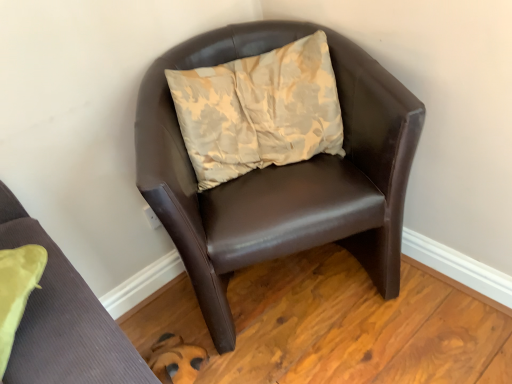
Question: Does brown leather chair at upper right, acting as the first chair starting from the front, have a larger size compared to brown leather chair at center, acting as the second chair starting from the front?

Choices:
 (A) yes
 (B) no

Answer: (B)

Question: From the image's perspective, is brown leather chair at upper right, acting as the first chair starting from the front, beneath brown leather chair at center, the first chair in the back-to-front sequence?

Choices:
 (A) yes
 (B) no

Answer: (A)

Question: Could you tell me if brown leather chair at upper right, acting as the first chair starting from the front, is facing brown leather chair at center, the first chair in the back-to-front sequence?

Choices:
 (A) yes
 (B) no

Answer: (B)

Question: Is brown leather chair at upper right, acting as the first chair starting from the front, outside of brown leather chair at center, acting as the second chair starting from the front?

Choices:
 (A) yes
 (B) no

Answer: (A)

Question: Is brown leather chair at upper right, which is the 2th chair from back to front, to the left of brown leather chair at center, acting as the second chair starting from the front, from the viewer's perspective?

Choices:
 (A) no
 (B) yes

Answer: (B)

Question: From the image's perspective, is brown leather chair at upper right, which is the 2th chair from back to front, above or below beige floral cushion at center?

Choices:
 (A) above
 (B) below

Answer: (B)

Question: Is point (86, 367) positioned closer to the camera than point (228, 132)?

Choices:
 (A) closer
 (B) farther

Answer: (A)

Question: Considering the positions of brown leather chair at upper right, acting as the first chair starting from the front, and beige floral cushion at center in the image, is brown leather chair at upper right, acting as the first chair starting from the front, taller or shorter than beige floral cushion at center?

Choices:
 (A) tall
 (B) short

Answer: (A)

Question: Is brown leather chair at upper right, acting as the first chair starting from the front, wider or thinner than beige floral cushion at center?

Choices:
 (A) wide
 (B) thin

Answer: (A)

Question: In the image, is beige floral cushion at center on the left side or the right side of brown leather chair at upper right, acting as the first chair starting from the front?

Choices:
 (A) right
 (B) left

Answer: (A)

Question: In the image, is beige floral cushion at center positioned in front of or behind brown leather chair at upper right, which is the 2th chair from back to front?

Choices:
 (A) behind
 (B) front

Answer: (A)

Question: Based on their sizes in the image, would you say beige floral cushion at center is bigger or smaller than brown leather chair at upper right, which is the 2th chair from back to front?

Choices:
 (A) small
 (B) big

Answer: (A)

Question: Considering the positions of beige floral cushion at center and brown leather chair at upper right, acting as the first chair starting from the front, in the image, is beige floral cushion at center taller or shorter than brown leather chair at upper right, acting as the first chair starting from the front,?

Choices:
 (A) tall
 (B) short

Answer: (B)

Question: Is brown leather chair at center, the first chair in the back-to-front sequence, to the left or to the right of brown leather chair at upper right, which is the 2th chair from back to front, in the image?

Choices:
 (A) left
 (B) right

Answer: (B)

Question: In the image, is brown leather chair at center, acting as the second chair starting from the front, positioned in front of or behind brown leather chair at upper right, acting as the first chair starting from the front?

Choices:
 (A) front
 (B) behind

Answer: (B)